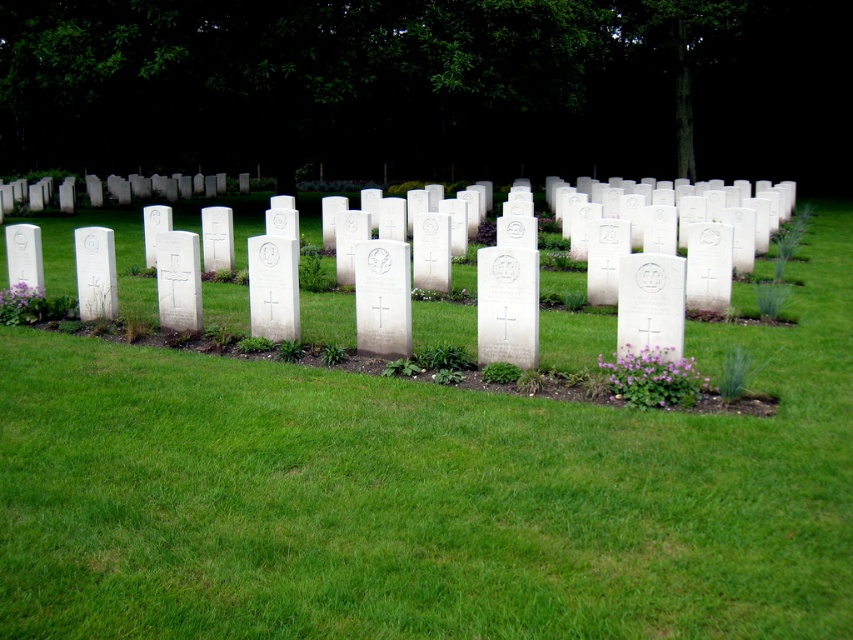
Can you confirm if purple matte flower at lower right is positioned to the right of white stone cross at left?

Correct, you'll find purple matte flower at lower right to the right of white stone cross at left.

Does purple matte flower at lower right lie behind white stone cross at left?

No.

Identify the location of purple matte flower at lower right. (653, 378).

At what (x,y) coordinates should I click in order to perform the action: click on purple matte flower at lower right. Please return your answer as a coordinate pair (x, y). The width and height of the screenshot is (853, 640). Looking at the image, I should click on (653, 378).

Is green grass at center shorter than purple matte flower at lower left?

No, green grass at center is not shorter than purple matte flower at lower left.

Is green grass at center bigger than purple matte flower at lower left?

Correct, green grass at center is larger in size than purple matte flower at lower left.

Is point (55, 490) positioned in front of point (44, 296)?

Yes.

This screenshot has width=853, height=640. In order to click on green grass at center in this screenshot , I will do `click(426, 493)`.

Does green grass at center have a lesser height compared to white stone cross at left?

No.

Can you confirm if green grass at center is smaller than white stone cross at left?

Actually, green grass at center might be larger than white stone cross at left.

This screenshot has height=640, width=853. What are the coordinates of `green grass at center` in the screenshot? It's located at (426, 493).

You are a GUI agent. You are given a task and a screenshot of the screen. Output one action in this format:
    pyautogui.click(x=<x>, y=<y>)
    Task: Click on the green grass at center
    Image resolution: width=853 pixels, height=640 pixels.
    Given the screenshot: What is the action you would take?
    pyautogui.click(x=426, y=493)